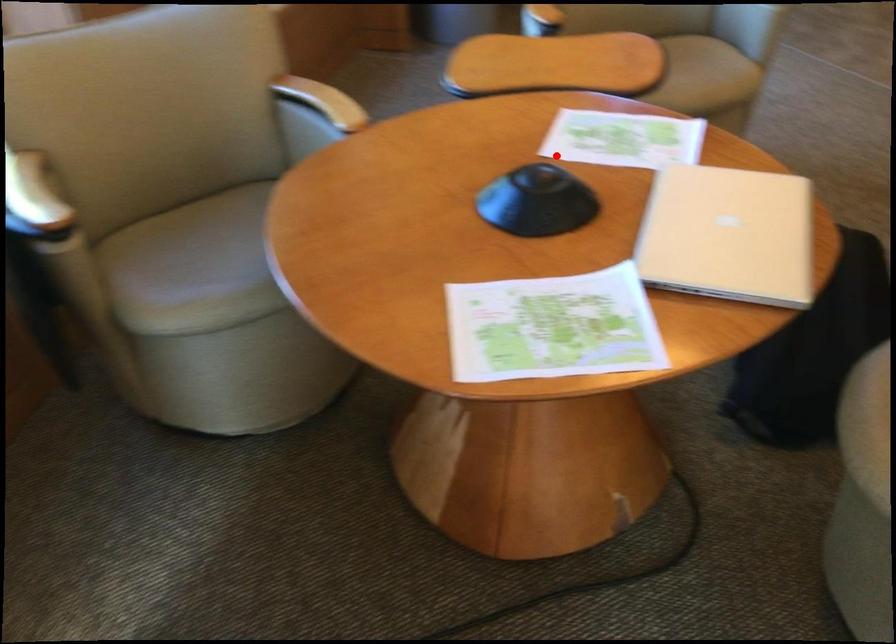
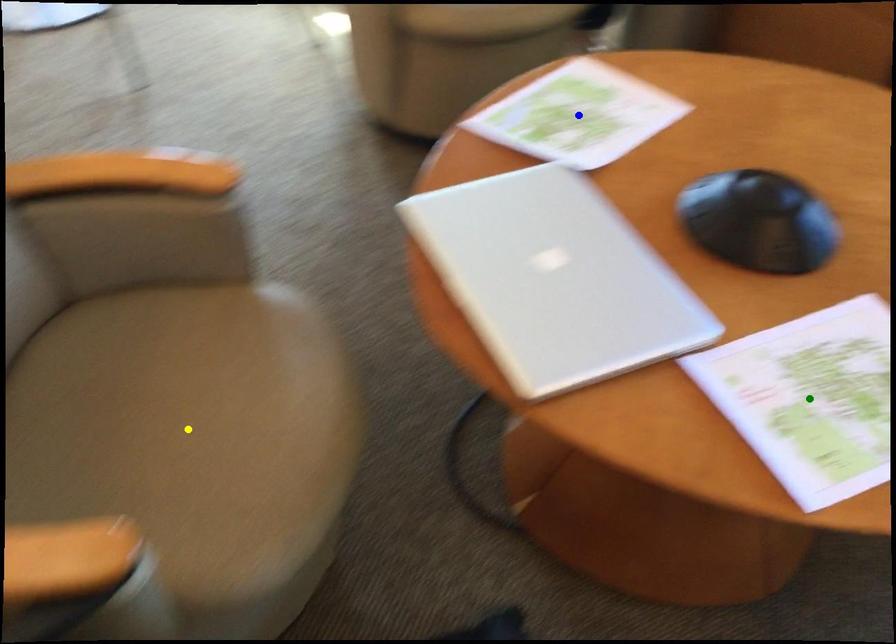
Question: I am providing you with two images of the same scene from different viewpoints. A red point is marked on the first image. You are given multiple points on the second image. Which point in image 2 represents the same 3d spot as the red point in image 1?

Choices:
 (A) yellow point
 (B) green point
 (C) blue point

Answer: (B)